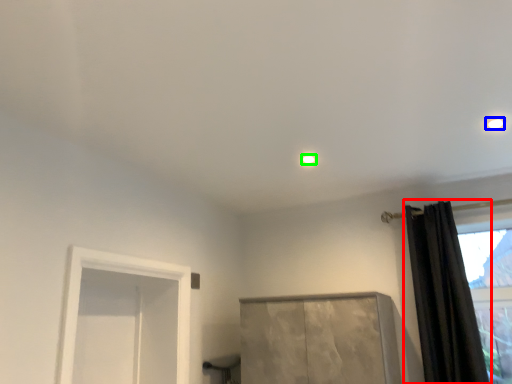
Question: Which object is positioned farthest from curtain (highlighted by a red box)? Select from lighting (highlighted by a blue box) and lighting (highlighted by a green box).

Choices:
 (A) lighting
 (B) lighting

Answer: (B)